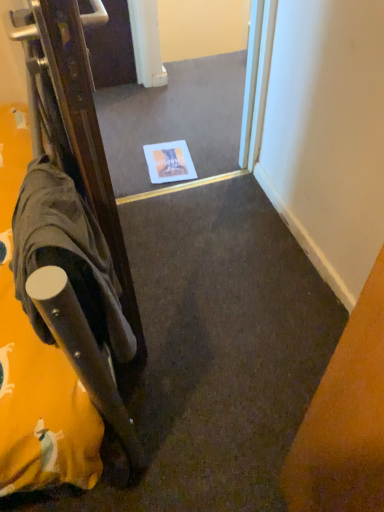
This screenshot has height=512, width=384. Describe the element at coordinates (67, 255) in the screenshot. I see `dark gray fabric robe at left` at that location.

Locate an element on the screen. This screenshot has width=384, height=512. dark gray fabric robe at left is located at coordinates (67, 255).

The image size is (384, 512). I want to click on white glossy mirror at center, so click(175, 120).

Describe the element at coordinates (175, 120) in the screenshot. The height and width of the screenshot is (512, 384). I see `white glossy mirror at center` at that location.

Find the location of a particular element. This screenshot has height=512, width=384. dark gray fabric robe at left is located at coordinates (67, 255).

Is white glossy mirror at center to the right of dark gray fabric robe at left from the viewer's perspective?

Indeed, white glossy mirror at center is positioned on the right side of dark gray fabric robe at left.

Is white glossy mirror at center in front of or behind dark gray fabric robe at left in the image?

white glossy mirror at center is behind dark gray fabric robe at left.

Is point (112, 154) in front of point (123, 336)?

No, it is behind (123, 336).

From the image's perspective, is white glossy mirror at center below dark gray fabric robe at left?

Incorrect, from the image's perspective, white glossy mirror at center is higher than dark gray fabric robe at left.

From a real-world perspective, between white glossy mirror at center and dark gray fabric robe at left, who is vertically lower?

From a 3D spatial view, white glossy mirror at center is below.

Between white glossy mirror at center and dark gray fabric robe at left, which one has smaller width?

Thinner between the two is dark gray fabric robe at left.

Can you confirm if white glossy mirror at center is shorter than dark gray fabric robe at left?

Yes, white glossy mirror at center is shorter than dark gray fabric robe at left.

Considering the sizes of objects white glossy mirror at center and dark gray fabric robe at left in the image provided, who is bigger, white glossy mirror at center or dark gray fabric robe at left?

With larger size is white glossy mirror at center.

Is white glossy mirror at center positioned beyond the bounds of dark gray fabric robe at left?

Yes, white glossy mirror at center is outside of dark gray fabric robe at left.

Is white glossy mirror at center positioned far away from dark gray fabric robe at left?

Yes, white glossy mirror at center is far from dark gray fabric robe at left.

Is white glossy mirror at center positioned with its back to dark gray fabric robe at left?

No, white glossy mirror at center's orientation is not away from dark gray fabric robe at left.

How different are the orientations of white glossy mirror at center and dark gray fabric robe at left in degrees?

They differ by 92.3 degrees in their facing directions.

Find the location of `mirror to the right of dark gray fabric robe at left`. mirror to the right of dark gray fabric robe at left is located at coordinates (175, 120).

Is dark gray fabric robe at left to the right of white glossy mirror at center from the viewer's perspective?

In fact, dark gray fabric robe at left is to the left of white glossy mirror at center.

In the image, is dark gray fabric robe at left positioned in front of or behind white glossy mirror at center?

Clearly, dark gray fabric robe at left is in front of white glossy mirror at center.

Which is behind, point (108, 284) or point (228, 77)?

Point (228, 77)

From the image's perspective, is dark gray fabric robe at left below white glossy mirror at center?

Yes.

In the scene shown: From a real-world perspective, is dark gray fabric robe at left positioned above or below white glossy mirror at center?

Clearly, from a real-world perspective, dark gray fabric robe at left is above white glossy mirror at center.

Is dark gray fabric robe at left wider than white glossy mirror at center?

Incorrect, the width of dark gray fabric robe at left does not surpass that of white glossy mirror at center.

Is dark gray fabric robe at left taller or shorter than white glossy mirror at center?

Clearly, dark gray fabric robe at left is taller compared to white glossy mirror at center.

In the scene shown: Considering the sizes of objects dark gray fabric robe at left and white glossy mirror at center in the image provided, who is bigger, dark gray fabric robe at left or white glossy mirror at center?

white glossy mirror at center.

Would you say dark gray fabric robe at left is inside or outside white glossy mirror at center?

dark gray fabric robe at left is spatially situated outside white glossy mirror at center.

Are dark gray fabric robe at left and white glossy mirror at center making contact?

dark gray fabric robe at left and white glossy mirror at center are not in contact.

Is dark gray fabric robe at left turned away from white glossy mirror at center?

No, dark gray fabric robe at left is not facing away from white glossy mirror at center.

How far apart are dark gray fabric robe at left and white glossy mirror at center?

They are 4.47 feet apart.

At what (x,y) coordinates should I click in order to perform the action: click on mirror above the dark gray fabric robe at left (from the image's perspective). Please return your answer as a coordinate pair (x, y). The image size is (384, 512). Looking at the image, I should click on (175, 120).

Find the location of a particular element. The image size is (384, 512). robe on the left of white glossy mirror at center is located at coordinates (67, 255).

Find the location of a particular element. Image resolution: width=384 pixels, height=512 pixels. robe in front of the white glossy mirror at center is located at coordinates (67, 255).